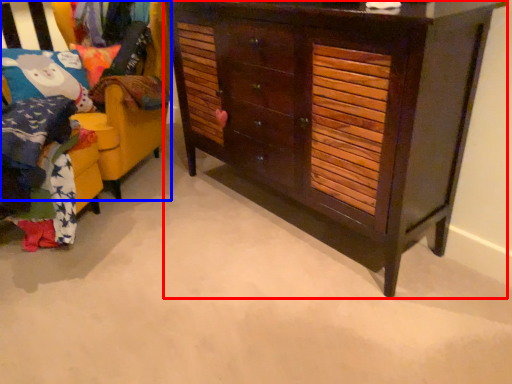
Question: Which object is further to the camera taking this photo, chest of drawers (highlighted by a red box) or furniture (highlighted by a blue box)?

Choices:
 (A) chest of drawers
 (B) furniture

Answer: (B)